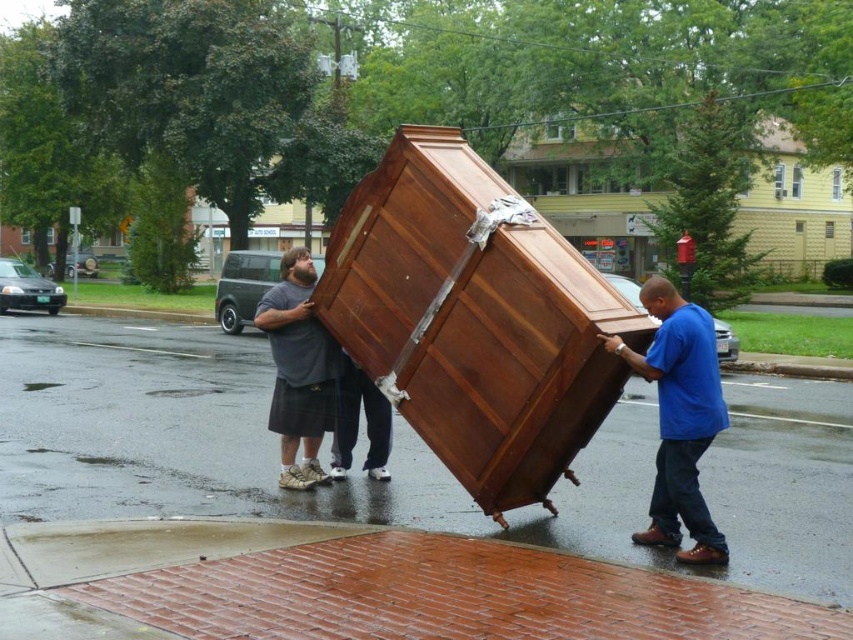
Question: Does blue cotton shirt at right appear on the left side of gray cotton shirt at center?

Choices:
 (A) no
 (B) yes

Answer: (A)

Question: Which point is closer to the camera?

Choices:
 (A) blue cotton shirt at right
 (B) gray cotton shirt at center

Answer: (A)

Question: Is blue cotton shirt at right above gray cotton shirt at center?

Choices:
 (A) yes
 (B) no

Answer: (B)

Question: Which point is closer to the camera?

Choices:
 (A) (660, 460)
 (B) (277, 332)

Answer: (A)

Question: Which point is closer to the camera?

Choices:
 (A) (302, 378)
 (B) (682, 486)

Answer: (B)

Question: Does blue cotton shirt at right have a smaller size compared to gray cotton shirt at center?

Choices:
 (A) yes
 (B) no

Answer: (B)